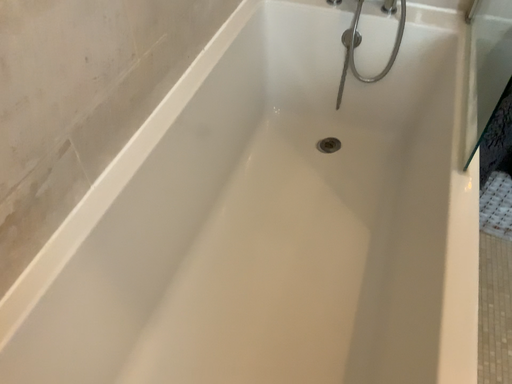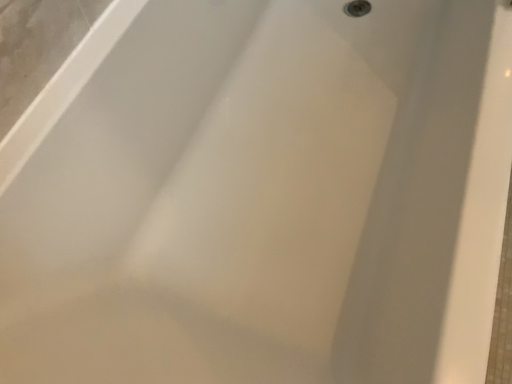
Question: Which way did the camera rotate in the video?

Choices:
 (A) rotated upward
 (B) rotated downward

Answer: (B)